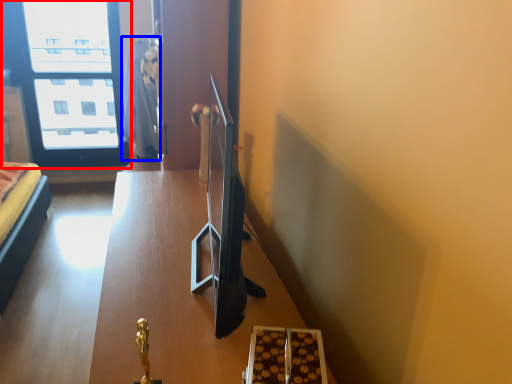
Question: Which object appears closest to the camera in this image, window (highlighted by a red box) or robe (highlighted by a blue box)?

Choices:
 (A) window
 (B) robe

Answer: (B)